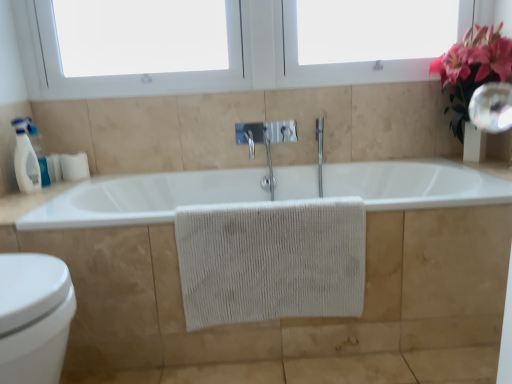
Question: Is white glossy bottle at left wider or thinner than white matte toilet paper at left?

Choices:
 (A) thin
 (B) wide

Answer: (A)

Question: Is white glossy bottle at left spatially inside white matte toilet paper at left, or outside of it?

Choices:
 (A) inside
 (B) outside

Answer: (B)

Question: Estimate the real-world distances between objects in this image. Which object is closer to the clear glass mirror at upper right?

Choices:
 (A) white plastic window at upper center, which is the second window screen in right-to-left order
 (B) white glossy bidet at lower left
 (C) white matte toilet paper at left
 (D) white plastic window screen at upper right, which is counted as the second window screen, starting from the left
 (E) white matte bathtub at center

Answer: (B)

Question: Estimate the real-world distances between objects in this image. Which object is farther from the beige textured towel at center?

Choices:
 (A) white plastic window screen at upper right, which is counted as the second window screen, starting from the left
 (B) clear glass mirror at upper right
 (C) white plastic window at upper center, the first window screen when ordered from left to right
 (D) white matte bathtub at center
 (E) white glossy bidet at lower left

Answer: (A)